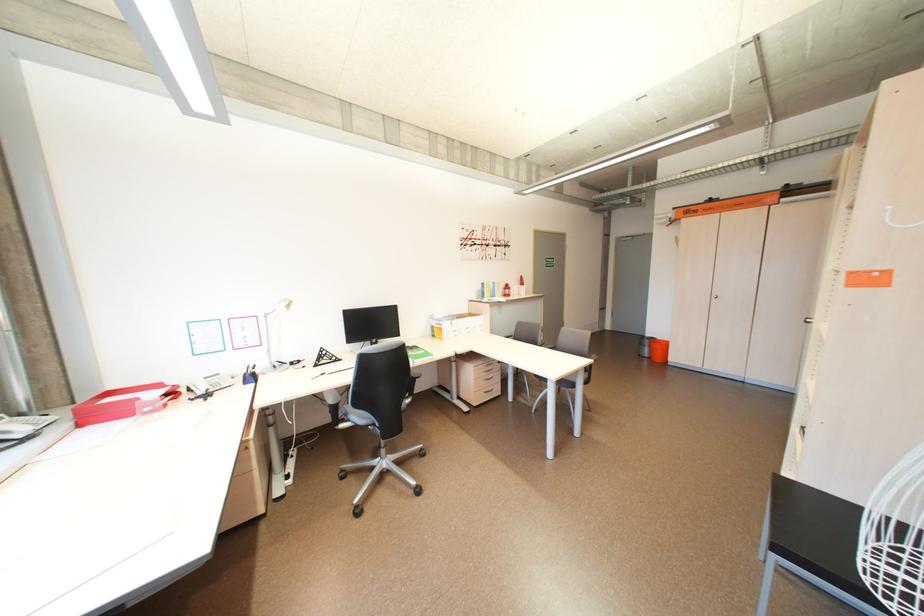
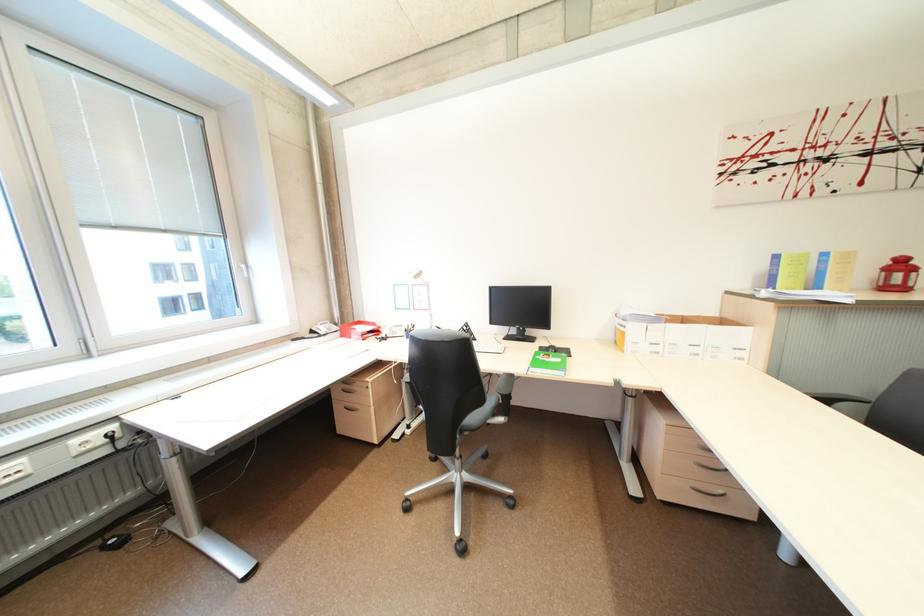
Find the pixel in the second image that matches (516,288) in the first image.

(910, 265)